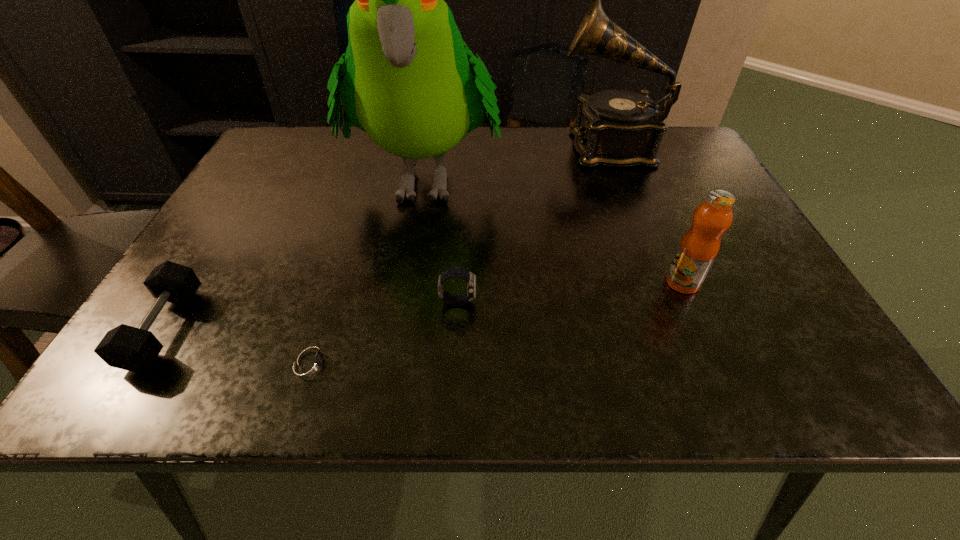
This screenshot has width=960, height=540. In order to click on vacant point located between the dumbbell and the farther watch in this screenshot , I will do `click(311, 315)`.

The width and height of the screenshot is (960, 540). In order to click on unoccupied position between the shortest object and the leftmost object in this screenshot , I will do `click(238, 345)`.

You are a GUI agent. You are given a task and a screenshot of the screen. Output one action in this format:
    pyautogui.click(x=<x>, y=<y>)
    Task: Click on the free space between the phonograph record and the shorter watch
    Image resolution: width=960 pixels, height=540 pixels.
    Given the screenshot: What is the action you would take?
    pyautogui.click(x=460, y=254)

Identify the location of free point between the left watch and the second tallest object. The height and width of the screenshot is (540, 960). (460, 254).

You are a GUI agent. You are given a task and a screenshot of the screen. Output one action in this format:
    pyautogui.click(x=<x>, y=<y>)
    Task: Click on the vacant area between the fruit juice and the farther watch
    The width and height of the screenshot is (960, 540).
    Given the screenshot: What is the action you would take?
    pyautogui.click(x=570, y=292)

Where is `unoccupied area between the third tallest object and the parakeet`? This screenshot has width=960, height=540. unoccupied area between the third tallest object and the parakeet is located at coordinates (554, 229).

In order to click on free space between the parakeet and the shortest object in this screenshot , I will do `click(368, 269)`.

Locate an element on the screen. Image resolution: width=960 pixels, height=540 pixels. vacant space that's between the shortest object and the third tallest object is located at coordinates (496, 322).

Identify the location of free space between the taller watch and the phonograph record. The height and width of the screenshot is (540, 960). (533, 224).

The image size is (960, 540). I want to click on free space that is in between the leftmost object and the fruit juice, so click(423, 305).